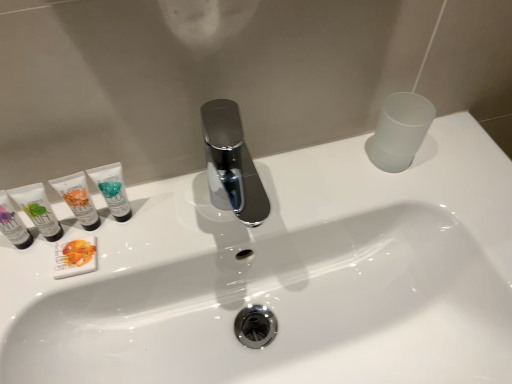
Question: Is matte white tube at left, which is the 1th toiletry from left to right, taller than white matte soap bar at left, the 3th toiletry from the left?

Choices:
 (A) no
 (B) yes

Answer: (B)

Question: From a real-world perspective, is matte white tube at left, the fifth toiletry in the right-to-left sequence, on top of white matte soap bar at left, the third toiletry positioned from the right?

Choices:
 (A) no
 (B) yes

Answer: (B)

Question: Does matte white tube at left, the fifth toiletry in the right-to-left sequence, have a greater width compared to white matte soap bar at left, the 3th toiletry from the left?

Choices:
 (A) yes
 (B) no

Answer: (B)

Question: Is white matte soap bar at left, the 3th toiletry from the left, at the back of matte white tube at left, the fifth toiletry in the right-to-left sequence?

Choices:
 (A) no
 (B) yes

Answer: (A)

Question: From the image's perspective, would you say matte white tube at left, which is the 1th toiletry from left to right, is positioned over white matte soap bar at left, the third toiletry positioned from the right?

Choices:
 (A) yes
 (B) no

Answer: (A)

Question: From the image's perspective, does matte white tube at left, the fifth toiletry in the right-to-left sequence, appear lower than white matte soap bar at left, the 3th toiletry from the left?

Choices:
 (A) yes
 (B) no

Answer: (B)

Question: Considering the relative sizes of white matte soap bar at left, the third toiletry positioned from the right, and white matte tube at left, the second toiletry from the right, in the image provided, is white matte soap bar at left, the third toiletry positioned from the right, wider than white matte tube at left, the second toiletry from the right,?

Choices:
 (A) no
 (B) yes

Answer: (B)

Question: Is white matte soap bar at left, the 3th toiletry from the left, in front of white matte tube at left, the second toiletry from the right?

Choices:
 (A) no
 (B) yes

Answer: (A)

Question: Considering the relative sizes of white matte soap bar at left, the third toiletry positioned from the right, and white matte tube at left, the 4th toiletry positioned from the left, in the image provided, is white matte soap bar at left, the third toiletry positioned from the right, smaller than white matte tube at left, the 4th toiletry positioned from the left,?

Choices:
 (A) no
 (B) yes

Answer: (B)

Question: From a real-world perspective, is white matte soap bar at left, the 3th toiletry from the left, physically below white matte tube at left, the 4th toiletry positioned from the left?

Choices:
 (A) no
 (B) yes

Answer: (B)

Question: Is white matte soap bar at left, the third toiletry positioned from the right, not inside white matte tube at left, the second toiletry from the right?

Choices:
 (A) yes
 (B) no

Answer: (A)

Question: Does white matte soap bar at left, the 3th toiletry from the left, contain white matte tube at left, the 4th toiletry positioned from the left?

Choices:
 (A) no
 (B) yes

Answer: (A)

Question: Is white matte soap bar at left, the 3th toiletry from the left, taller than matte white tube at left, the fifth toiletry in the right-to-left sequence?

Choices:
 (A) yes
 (B) no

Answer: (B)